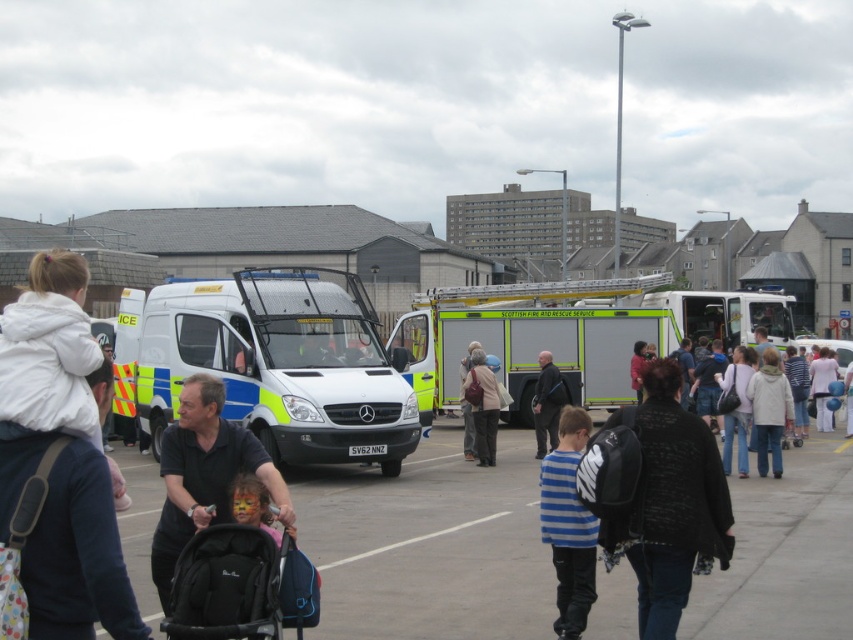
Can you confirm if white metallic fire truck at center is smaller than white fleece jacket at upper left?

Incorrect, white metallic fire truck at center is not smaller in size than white fleece jacket at upper left.

Can you confirm if white metallic fire truck at center is wider than white fleece jacket at upper left?

Indeed, white metallic fire truck at center has a greater width compared to white fleece jacket at upper left.

Who is more distant from viewer, (x=624, y=358) or (x=4, y=360)?

Positioned behind is point (x=624, y=358).

In order to click on white metallic fire truck at center in this screenshot , I will do `click(527, 339)`.

Does point (184, 298) come farther from viewer compared to point (639, 563)?

That is True.

Can you confirm if white glossy van at center is thinner than black backpack at center?

Yes, white glossy van at center is thinner than black backpack at center.

Who is more distant from viewer, (292, 428) or (666, 612)?

The point (292, 428) is behind.

You are a GUI agent. You are given a task and a screenshot of the screen. Output one action in this format:
    pyautogui.click(x=<x>, y=<y>)
    Task: Click on the white glossy van at center
    
    Given the screenshot: What is the action you would take?
    pyautogui.click(x=271, y=364)

Is point (722, 540) positioned behind point (579, 556)?

No, it is not.

Can you confirm if black backpack at center is positioned to the left of blue striped shirt at center?

Incorrect, black backpack at center is not on the left side of blue striped shirt at center.

Does point (662, 385) come in front of point (564, 624)?

Yes, point (662, 385) is closer to viewer.

Identify the location of black backpack at center. The width and height of the screenshot is (853, 640). (657, 497).